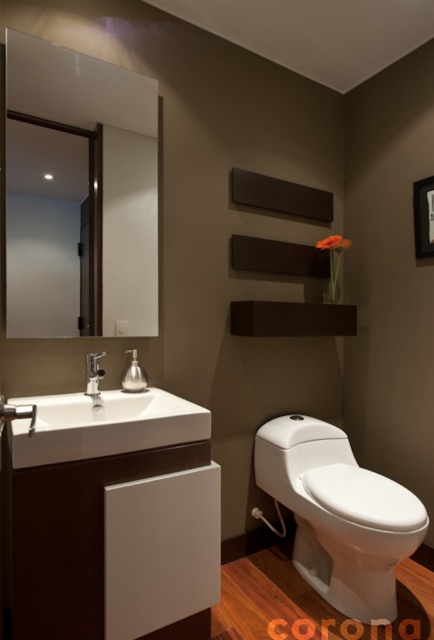
Can you confirm if black matte picture frame at upper right is positioned to the left of silver metallic faucet at sink left?

No, black matte picture frame at upper right is not to the left of silver metallic faucet at sink left.

Between black matte picture frame at upper right and silver metallic faucet at sink left, which one is positioned lower?

silver metallic faucet at sink left is below.

Where is `black matte picture frame at upper right`? Image resolution: width=434 pixels, height=640 pixels. black matte picture frame at upper right is located at coordinates (424, 216).

Is clear glass mirror at upper left wider than silver metallic faucet at sink left?

Yes, clear glass mirror at upper left is wider than silver metallic faucet at sink left.

Does clear glass mirror at upper left appear over silver metallic faucet at sink left?

Correct, clear glass mirror at upper left is located above silver metallic faucet at sink left.

This screenshot has width=434, height=640. Describe the element at coordinates (78, 193) in the screenshot. I see `clear glass mirror at upper left` at that location.

Locate an element on the screen. The image size is (434, 640). clear glass mirror at upper left is located at coordinates (78, 193).

Does point (22, 168) come farther from viewer compared to point (102, 449)?

Yes, it is behind point (102, 449).

Does clear glass mirror at upper left have a greater width compared to white glossy sink at lower left?

No, clear glass mirror at upper left is not wider than white glossy sink at lower left.

Does point (81, 58) come in front of point (131, 420)?

No, it is not.

This screenshot has height=640, width=434. I want to click on clear glass mirror at upper left, so click(78, 193).